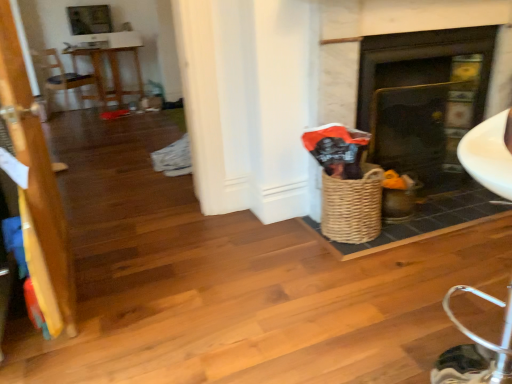
Question: From the image's perspective, is wooden armchair at left beneath matte black fireplace at center?

Choices:
 (A) yes
 (B) no

Answer: (B)

Question: Is wooden armchair at left shorter than matte black fireplace at center?

Choices:
 (A) yes
 (B) no

Answer: (A)

Question: Does wooden armchair at left lie behind matte black fireplace at center?

Choices:
 (A) no
 (B) yes

Answer: (B)

Question: Is wooden armchair at left next to matte black fireplace at center and touching it?

Choices:
 (A) yes
 (B) no

Answer: (B)

Question: Is wooden armchair at left at the left side of matte black fireplace at center?

Choices:
 (A) yes
 (B) no

Answer: (A)

Question: In terms of width, does wooden table at upper left look wider or thinner when compared to wooden door at left?

Choices:
 (A) wide
 (B) thin

Answer: (A)

Question: Considering the positions of wooden table at upper left and wooden door at left in the image, is wooden table at upper left taller or shorter than wooden door at left?

Choices:
 (A) tall
 (B) short

Answer: (B)

Question: Which is correct: wooden table at upper left is inside wooden door at left, or outside of it?

Choices:
 (A) outside
 (B) inside

Answer: (A)

Question: Is point (73, 69) positioned closer to the camera than point (15, 89)?

Choices:
 (A) closer
 (B) farther

Answer: (B)

Question: From the image's perspective, relative to woven brown basket at right, is wooden door at left above or below?

Choices:
 (A) below
 (B) above

Answer: (B)

Question: Considering their positions, is wooden door at left located in front of or behind woven brown basket at right?

Choices:
 (A) behind
 (B) front

Answer: (B)

Question: Based on their sizes in the image, would you say wooden door at left is bigger or smaller than woven brown basket at right?

Choices:
 (A) big
 (B) small

Answer: (A)

Question: Do you think wooden door at left is within woven brown basket at right, or outside of it?

Choices:
 (A) outside
 (B) inside

Answer: (A)

Question: In terms of size, does wooden armchair at left appear bigger or smaller than woven brown basket at right?

Choices:
 (A) big
 (B) small

Answer: (A)

Question: Considering the positions of wooden armchair at left and woven brown basket at right in the image, is wooden armchair at left taller or shorter than woven brown basket at right?

Choices:
 (A) short
 (B) tall

Answer: (B)